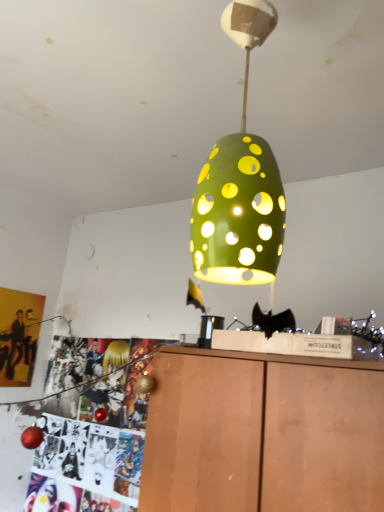
Question: Can you confirm if matte yellow poster at left is bigger than wooden cabinet at lower center?

Choices:
 (A) yes
 (B) no

Answer: (B)

Question: Would you consider matte yellow poster at left to be distant from wooden cabinet at lower center?

Choices:
 (A) no
 (B) yes

Answer: (B)

Question: Considering the relative sizes of matte yellow poster at left and wooden cabinet at lower center in the image provided, is matte yellow poster at left shorter than wooden cabinet at lower center?

Choices:
 (A) no
 (B) yes

Answer: (B)

Question: Is matte yellow poster at left taller than wooden cabinet at lower center?

Choices:
 (A) no
 (B) yes

Answer: (A)

Question: Is matte yellow poster at left in contact with wooden cabinet at lower center?

Choices:
 (A) yes
 (B) no

Answer: (B)

Question: Is point (206, 217) closer or farther from the camera than point (29, 317)?

Choices:
 (A) farther
 (B) closer

Answer: (B)

Question: In the image, is green matte/porcelain lamp at center on the left side or the right side of matte yellow poster at left?

Choices:
 (A) right
 (B) left

Answer: (A)

Question: From a real-world perspective, is green matte/porcelain lamp at center positioned above or below matte yellow poster at left?

Choices:
 (A) above
 (B) below

Answer: (A)

Question: From the image's perspective, is green matte/porcelain lamp at center above or below matte yellow poster at left?

Choices:
 (A) below
 (B) above

Answer: (B)

Question: From a real-world perspective, is wooden cabinet at lower center above or below matte yellow poster at left?

Choices:
 (A) below
 (B) above

Answer: (A)

Question: Is wooden cabinet at lower center taller or shorter than matte yellow poster at left?

Choices:
 (A) short
 (B) tall

Answer: (B)

Question: Considering their positions, is wooden cabinet at lower center located in front of or behind matte yellow poster at left?

Choices:
 (A) behind
 (B) front

Answer: (B)

Question: In terms of width, does wooden cabinet at lower center look wider or thinner when compared to matte yellow poster at left?

Choices:
 (A) thin
 (B) wide

Answer: (B)

Question: Considering the positions of green matte/porcelain lamp at center and wooden cabinet at lower center in the image, is green matte/porcelain lamp at center wider or thinner than wooden cabinet at lower center?

Choices:
 (A) wide
 (B) thin

Answer: (B)

Question: From a real-world perspective, is green matte/porcelain lamp at center physically located above or below wooden cabinet at lower center?

Choices:
 (A) below
 (B) above

Answer: (B)